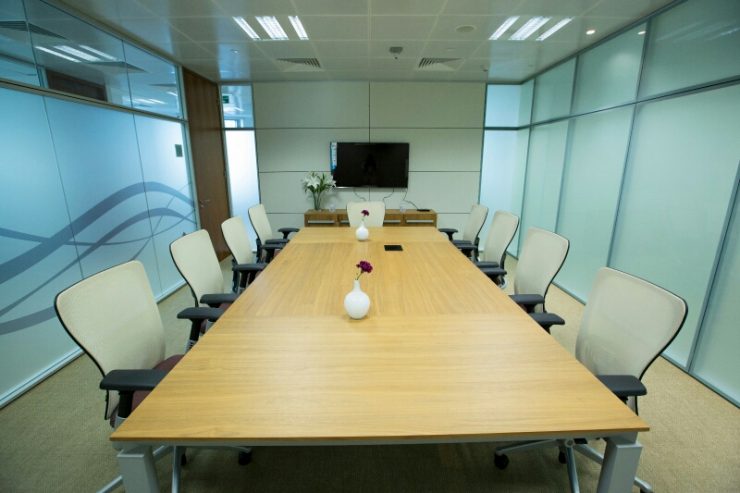
This screenshot has width=740, height=493. In order to click on reflection above door in this screenshot , I will do `click(198, 47)`.